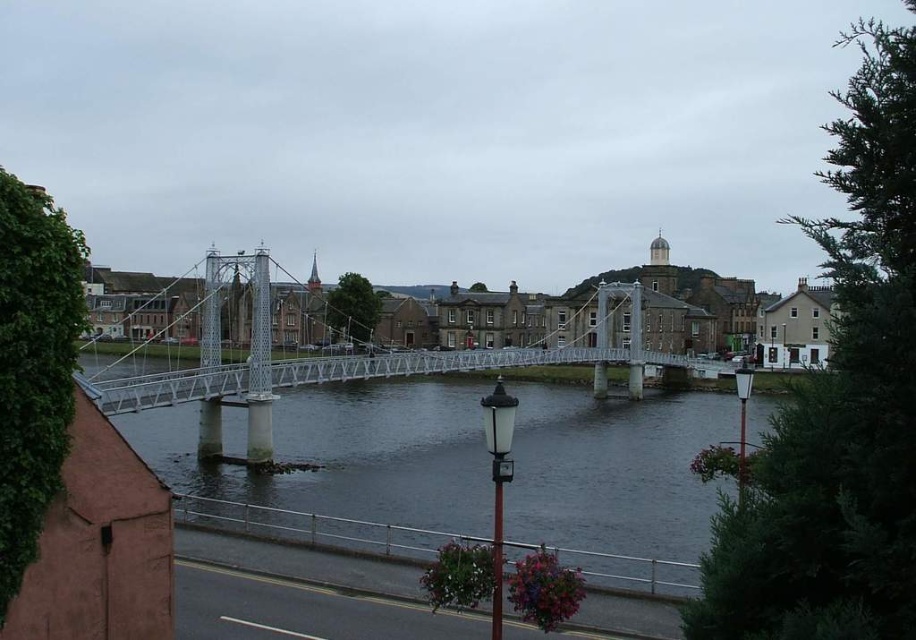
Question: Which point is closer to the camera?

Choices:
 (A) (740, 408)
 (B) (503, 480)

Answer: (B)

Question: Does white metal bridge at center lie in front of white glossy lamp post at center?

Choices:
 (A) yes
 (B) no

Answer: (B)

Question: Is clear water at center wider than white glossy lamp post at center?

Choices:
 (A) yes
 (B) no

Answer: (A)

Question: Does white metal bridge at center have a larger size compared to white plastic lamp post at lower right?

Choices:
 (A) no
 (B) yes

Answer: (B)

Question: Which object appears farthest from the camera in this image?

Choices:
 (A) white metal bridge at center
 (B) white glossy lamp post at center
 (C) white plastic lamp post at lower right
 (D) clear water at center

Answer: (A)

Question: Which of the following is the closest to the observer?

Choices:
 (A) (206, 448)
 (B) (511, 416)
 (C) (740, 376)
 (D) (165, 323)

Answer: (B)